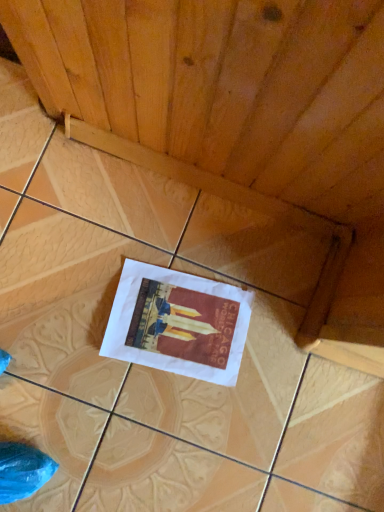
Identify the location of blank area beneath white paper poster at center (from a real-world perspective). This screenshot has height=512, width=384. (176, 325).